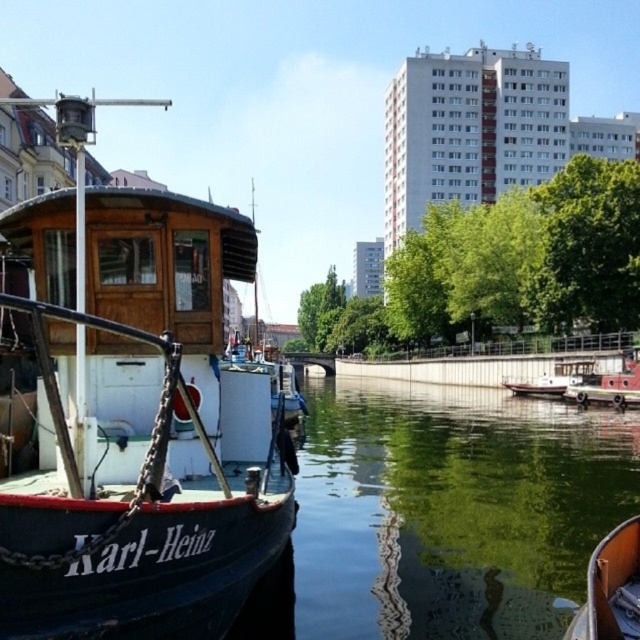
Question: Among these objects, which one is farthest from the camera?

Choices:
 (A) red metal boat at right
 (B) wooden cabin boat at left

Answer: (A)

Question: Which object is positioned farthest from the red metal boat at right?

Choices:
 (A) white glossy boat at center
 (B) wooden boat at center
 (C) wooden cabin boat at left

Answer: (B)

Question: Where is wooden boat at center located in relation to red metal boat at right in the image?

Choices:
 (A) left
 (B) right

Answer: (A)

Question: From the image, what is the correct spatial relationship of red metal boat at right in relation to white glossy boat at center?

Choices:
 (A) left
 (B) right

Answer: (B)

Question: Does wooden boat at center appear on the left side of red metal boat at right?

Choices:
 (A) no
 (B) yes

Answer: (B)

Question: Based on their relative distances, which object is farther from the wooden boat at center?

Choices:
 (A) white glossy boat at center
 (B) red metal boat at right

Answer: (A)